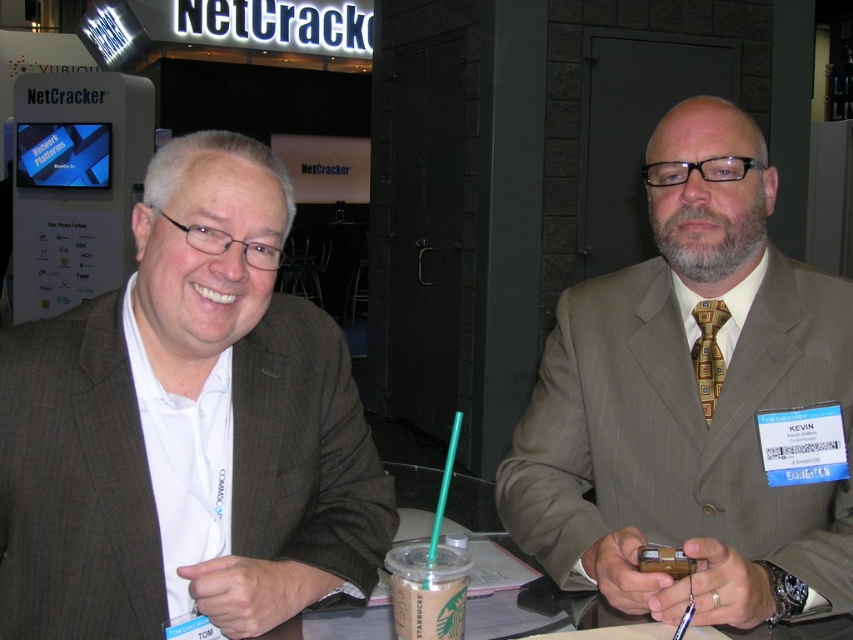
Question: Is matte gray suit at center smaller than brown paper cup at center?

Choices:
 (A) no
 (B) yes

Answer: (A)

Question: Where is matte brown suit at center located in relation to matte gray suit at center in the image?

Choices:
 (A) below
 (B) above

Answer: (A)

Question: Can you confirm if matte gray suit at center is positioned above brown paper cup at center?

Choices:
 (A) yes
 (B) no

Answer: (A)

Question: Among these objects, which one is farthest from the camera?

Choices:
 (A) brown paper cup at center
 (B) matte gray suit at center
 (C) matte brown suit at center

Answer: (B)

Question: Estimate the real-world distances between objects in this image. Which object is farther from the brown paper cup at center?

Choices:
 (A) matte gray suit at center
 (B) matte brown suit at center

Answer: (A)

Question: Which of the following is the farthest from the observer?

Choices:
 (A) matte gray suit at center
 (B) brown paper cup at center
 (C) matte brown suit at center

Answer: (A)